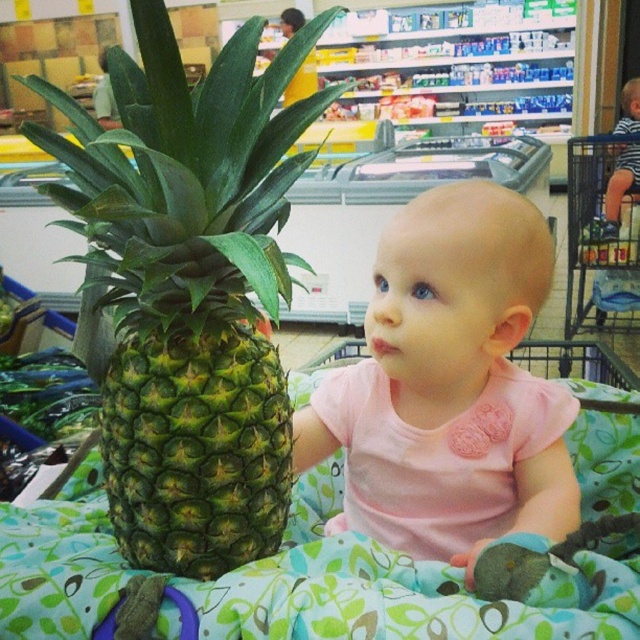
You are a store employee who needs to place a new sign at the point specified by the coordinates in the image. The coordinates given are point (189, 289). What object is located at this point?

The point (189, 289) corresponds to the green textured pineapple at center.